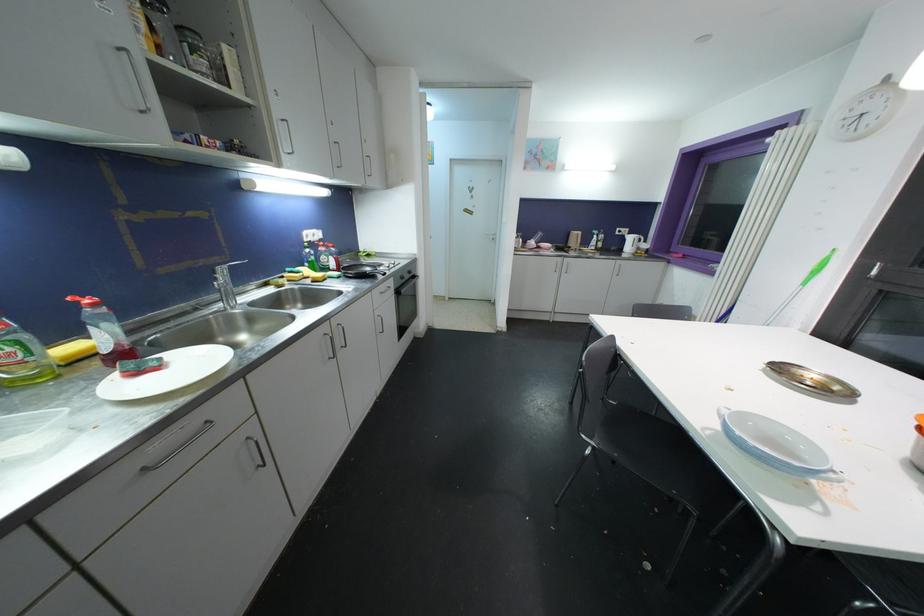
The image size is (924, 616). What do you see at coordinates (361, 270) in the screenshot? I see `the black frying pan` at bounding box center [361, 270].